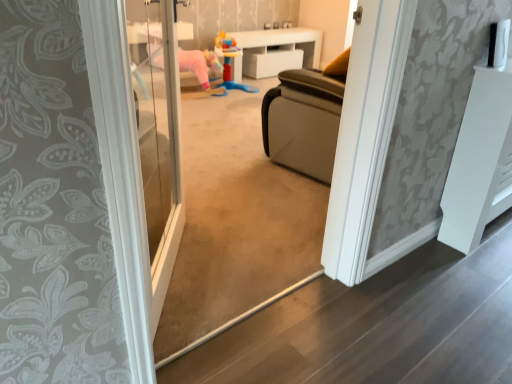
Question: From the image's perspective, is white glossy cabinet at upper center, the first furniture when ordered from back to front, above plastic colorful toy at center?

Choices:
 (A) yes
 (B) no

Answer: (A)

Question: From the image's perspective, is white glossy cabinet at upper center, which is the 2th furniture in bottom-to-top order, under plastic colorful toy at center?

Choices:
 (A) no
 (B) yes

Answer: (A)

Question: Is white glossy cabinet at upper center, the 1th furniture positioned from the top, to the left of plastic colorful toy at center from the viewer's perspective?

Choices:
 (A) no
 (B) yes

Answer: (A)

Question: Is white glossy cabinet at upper center, the 1th furniture positioned from the top, far away from plastic colorful toy at center?

Choices:
 (A) no
 (B) yes

Answer: (A)

Question: Is white glossy cabinet at upper center, the 1th furniture positioned from the top, facing away from plastic colorful toy at center?

Choices:
 (A) no
 (B) yes

Answer: (A)

Question: From a real-world perspective, is white glossy cabinet at upper center, the 1th furniture positioned from the top, positioned above or below white matte radiator at right, the first furniture ordered from the bottom?

Choices:
 (A) below
 (B) above

Answer: (A)

Question: Is white glossy cabinet at upper center, which is the 1th furniture in left-to-right order, inside or outside of white matte radiator at right, the first furniture ordered from the bottom?

Choices:
 (A) outside
 (B) inside

Answer: (A)

Question: In the image, is white glossy cabinet at upper center, which is the 2th furniture in bottom-to-top order, on the left side or the right side of white matte radiator at right, the first furniture in the right-to-left sequence?

Choices:
 (A) left
 (B) right

Answer: (A)

Question: Considering the positions of white glossy cabinet at upper center, the second furniture positioned from the front, and white matte radiator at right, marked as the 2th furniture in a top-to-bottom arrangement, in the image, is white glossy cabinet at upper center, the second furniture positioned from the front, taller or shorter than white matte radiator at right, marked as the 2th furniture in a top-to-bottom arrangement,?

Choices:
 (A) tall
 (B) short

Answer: (B)

Question: From the image's perspective, is white glossy cabinet at upper center, the second furniture in the right-to-left sequence, positioned above or below plastic colorful toy at center?

Choices:
 (A) below
 (B) above

Answer: (B)

Question: Considering the positions of white glossy cabinet at upper center, which is the 1th furniture in left-to-right order, and plastic colorful toy at center in the image, is white glossy cabinet at upper center, which is the 1th furniture in left-to-right order, taller or shorter than plastic colorful toy at center?

Choices:
 (A) short
 (B) tall

Answer: (A)

Question: From a real-world perspective, is white glossy cabinet at upper center, the second furniture in the right-to-left sequence, positioned above or below plastic colorful toy at center?

Choices:
 (A) above
 (B) below

Answer: (B)

Question: Relative to plastic colorful toy at center, is white glossy cabinet at upper center, which is the 1th furniture in left-to-right order, in front or behind?

Choices:
 (A) behind
 (B) front

Answer: (A)

Question: In terms of size, does white matte radiator at right, marked as the 2th furniture in a top-to-bottom arrangement, appear bigger or smaller than white glossy cabinet at upper center, the second furniture in the right-to-left sequence?

Choices:
 (A) small
 (B) big

Answer: (A)

Question: Is point (457, 144) closer or farther from the camera than point (309, 43)?

Choices:
 (A) closer
 (B) farther

Answer: (A)